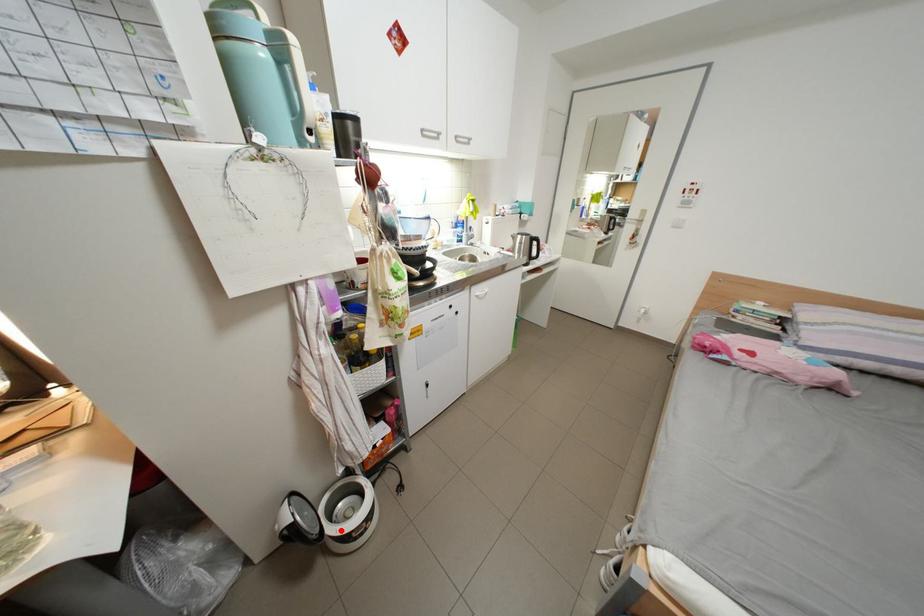
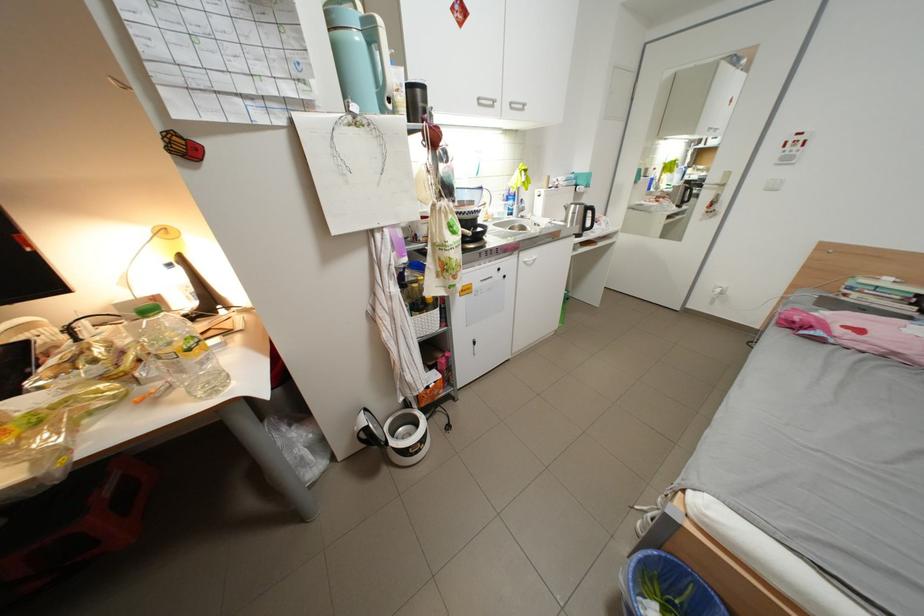
Where in the second image is the point corresponding to the highlighted location from the first image?

(404, 444)